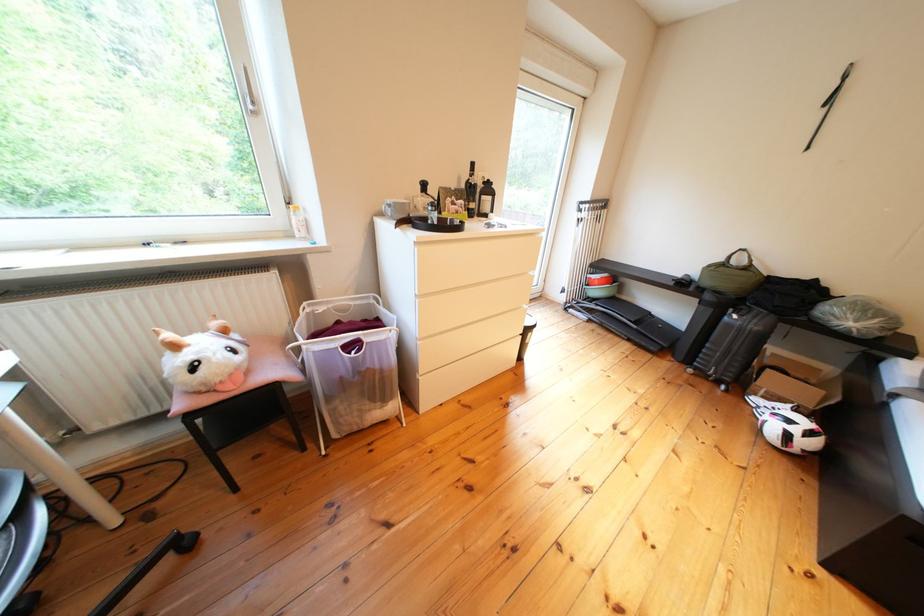
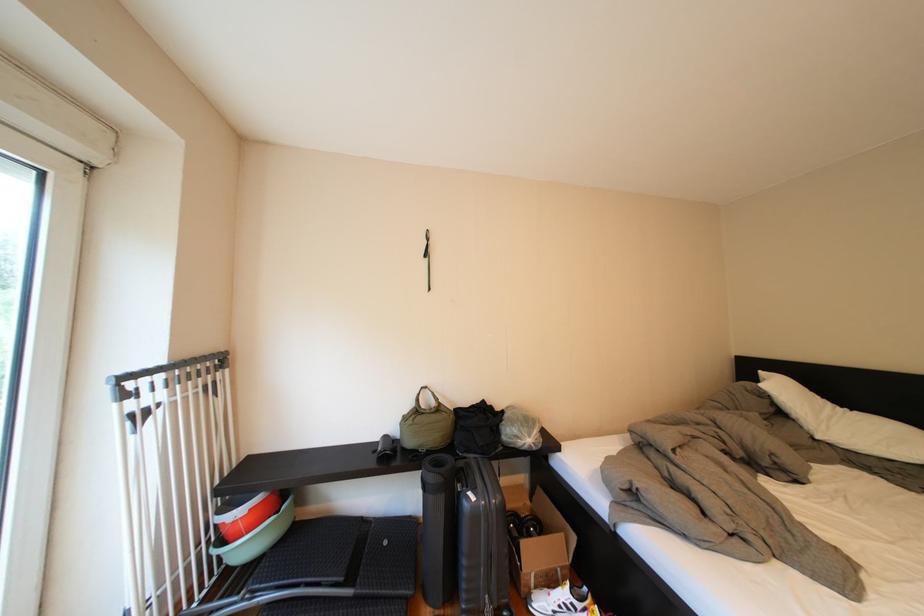
The point at (650, 334) is marked in the first image. Where is the corresponding point in the second image?

(370, 602)